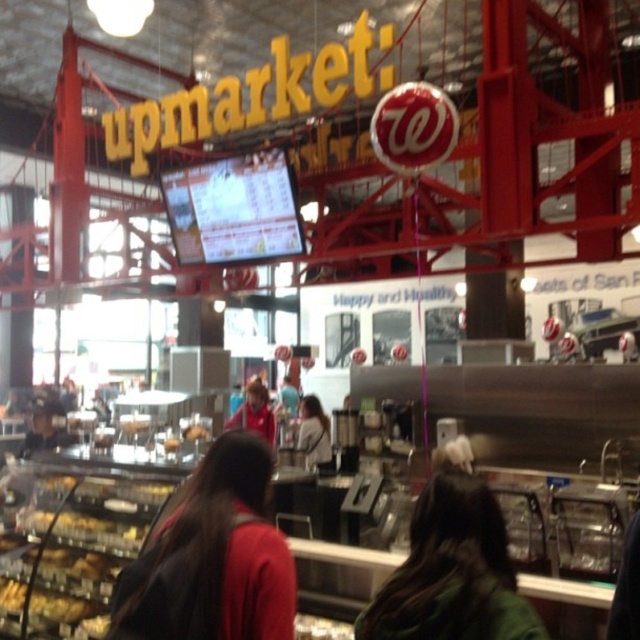
Is green fabric at center taller than translucent plastic tray at lower left?

No, green fabric at center is not taller than translucent plastic tray at lower left.

Is green fabric at center smaller than translucent plastic tray at lower left?

Indeed, green fabric at center has a smaller size compared to translucent plastic tray at lower left.

The width and height of the screenshot is (640, 640). What are the coordinates of `green fabric at center` in the screenshot? It's located at (452, 572).

Where is `green fabric at center`? This screenshot has height=640, width=640. green fabric at center is located at coordinates (452, 572).

Can you confirm if dark brown leather jacket at center is shorter than white fabric shirt at center?

In fact, dark brown leather jacket at center may be taller than white fabric shirt at center.

Who is more distant from viewer, (148, 602) or (316, 396)?

The point (316, 396) is more distant.

Is point (212, 627) more distant than point (326, 451)?

No, it is in front of (326, 451).

Identify the location of dark brown leather jacket at center. (212, 557).

Between point (108, 573) and point (300, 422), which one is positioned in front?

Point (108, 573)

Find the location of a particular element. The height and width of the screenshot is (640, 640). translucent plastic tray at lower left is located at coordinates (77, 554).